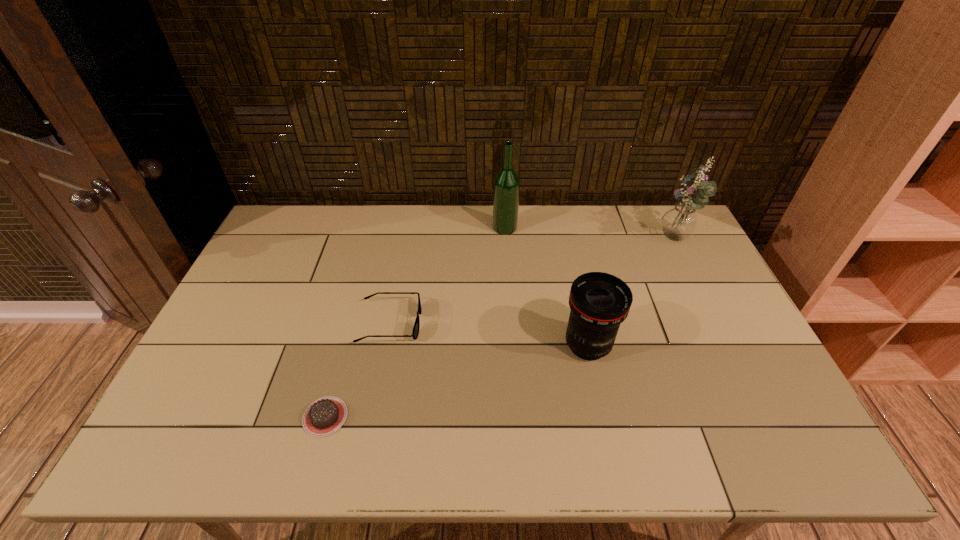
This screenshot has width=960, height=540. Find the location of `free area in between the nearest object and the telephoto lens`. free area in between the nearest object and the telephoto lens is located at coordinates (x=456, y=381).

In order to click on object that is the second closest to the alcohol in this screenshot , I will do `click(599, 302)`.

Identify which object is located as the fourth nearest to the bouquet. Please provide its 2D coordinates. Your answer should be formatted as a tuple, i.e. [(x, y)], where the tuple contains the x and y coordinates of a point satisfying the conditions above.

[(326, 415)]

I want to click on vacant area in the image that satisfies the following two spatial constraints: 1. on the front-facing side of the telephoto lens; 2. on the right side of the fourth tallest object, so click(x=386, y=346).